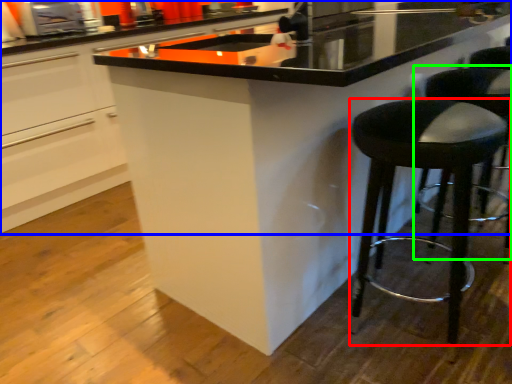
Question: Which object is the farthest from stool (highlighted by a red box)? Choose among these: cabinetry (highlighted by a blue box) or bar stool (highlighted by a green box).

Choices:
 (A) cabinetry
 (B) bar stool

Answer: (A)